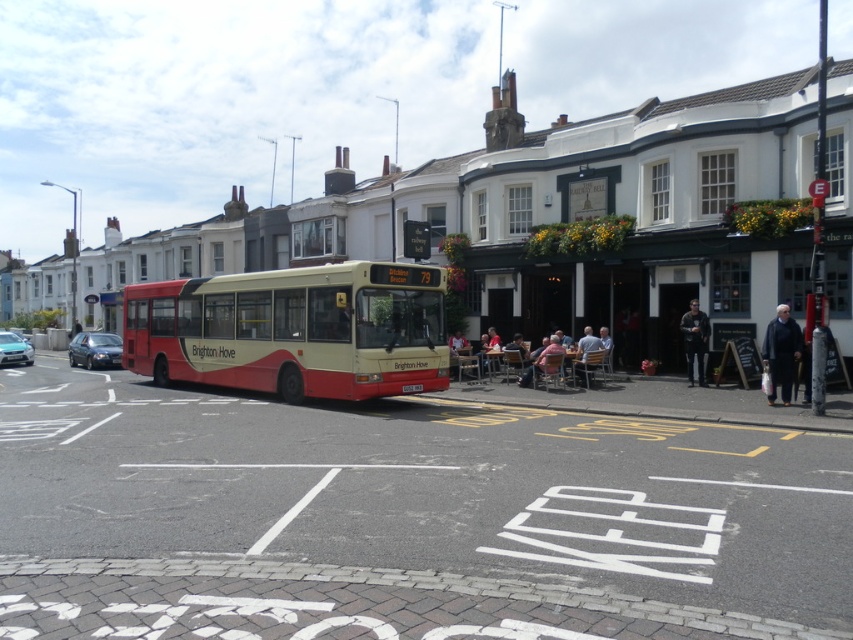
Does dark gray jacket at center have a larger size compared to metallic silver car at left?

Incorrect, dark gray jacket at center is not larger than metallic silver car at left.

Can you confirm if dark gray jacket at center is thinner than metallic silver car at left?

Yes.

Identify the location of dark gray jacket at center. (694, 340).

Who is more forward, (x=285, y=326) or (x=113, y=339)?

Point (x=285, y=326) is more forward.

Is red matte bus at center behind shiny black sedan at left?

No, it is in front of shiny black sedan at left.

The height and width of the screenshot is (640, 853). Identify the location of red matte bus at center. click(x=294, y=330).

The width and height of the screenshot is (853, 640). I want to click on red matte bus at center, so click(294, 330).

Is point (109, 356) farther from camera compared to point (589, 339)?

Yes, it is behind point (589, 339).

Does point (97, 337) lie behind point (592, 333)?

Yes, it is behind point (592, 333).

The height and width of the screenshot is (640, 853). I want to click on shiny black sedan at left, so click(96, 349).